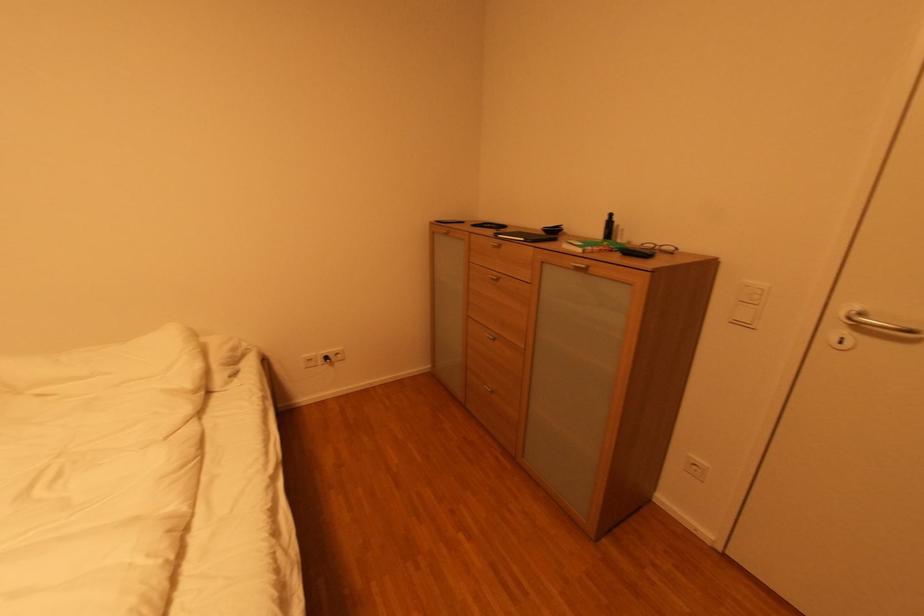
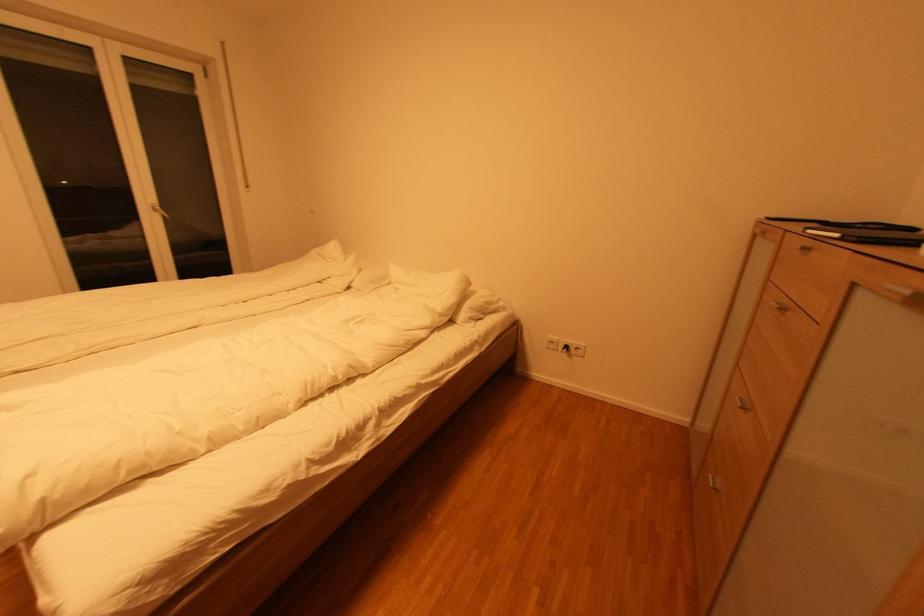
Question: The camera is either moving clockwise (left) or counter-clockwise (right) around the object. The first image is from the beginning of the video and the second image is from the end. Is the camera moving left or right when shooting the video?

Choices:
 (A) Left
 (B) Right

Answer: (B)